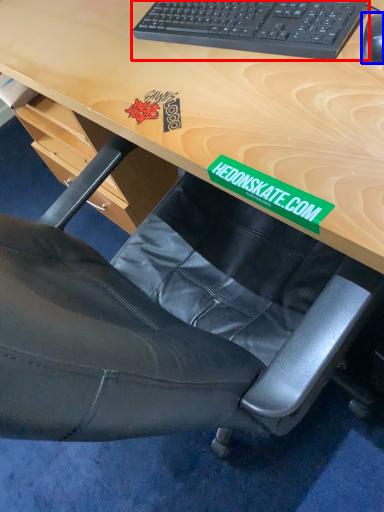
Question: Which object is further to the camera taking this photo, computer keyboard (highlighted by a red box) or mouse (highlighted by a blue box)?

Choices:
 (A) computer keyboard
 (B) mouse

Answer: (A)